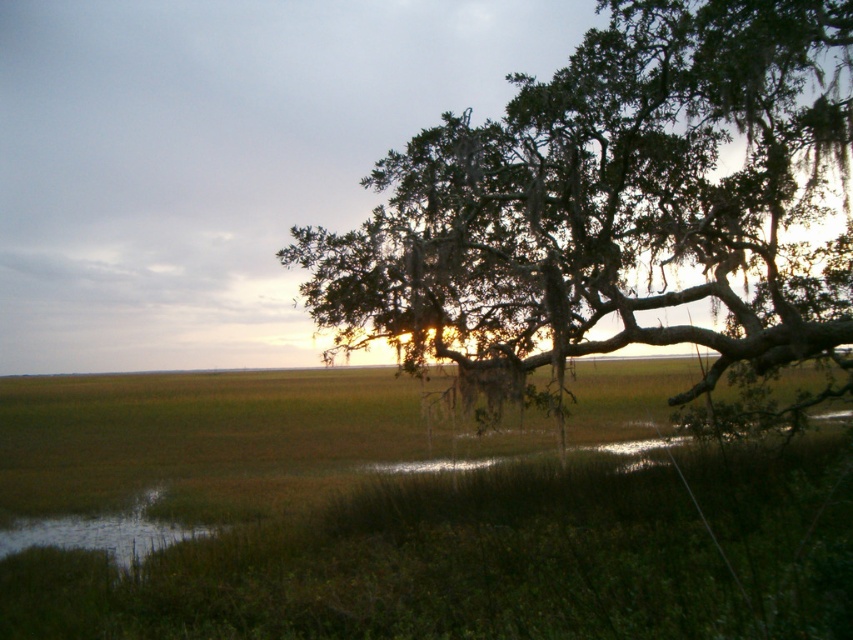
You are a photographer planning to capture the entire scene in one shot. Given that the green leafy tree at right and the green grassy water at lower left are both essential elements, will the tree occupy more horizontal space in the photo than the water?

The green leafy tree at right is wider than the green grassy water at lower left, so yes, the tree will occupy more horizontal space in the photo than the water.

You are a hiker who wants to cross from the green leafy tree at right to the green grassy water at lower left. The path between them is 10.10 meters. If your backpack has a weight limit of 20 kilograms, can you carry an extra 5 kilograms of supplies for the trip?

The distance between the green leafy tree at right and the green grassy water at lower left is 10.10 meters. However, the question about carrying an extra 5 kilograms of supplies depends on your current load, not the distance. The provided information does not mention your current backpack weight, so it cannot be determined.